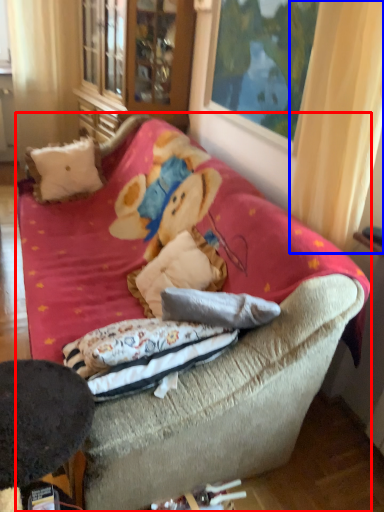
Question: Which object appears closest to the camera in this image, studio couch (highlighted by a red box) or curtain (highlighted by a blue box)?

Choices:
 (A) studio couch
 (B) curtain

Answer: (A)